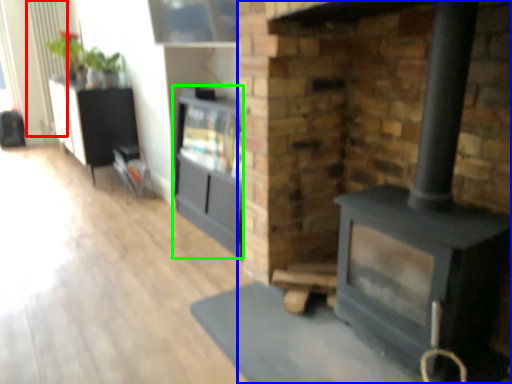
Question: Estimate the real-world distances between objects in this image. Which object is closer to radiator (highlighted by a red box), fireplace (highlighted by a blue box) or entertainment center (highlighted by a green box)?

Choices:
 (A) fireplace
 (B) entertainment center

Answer: (B)